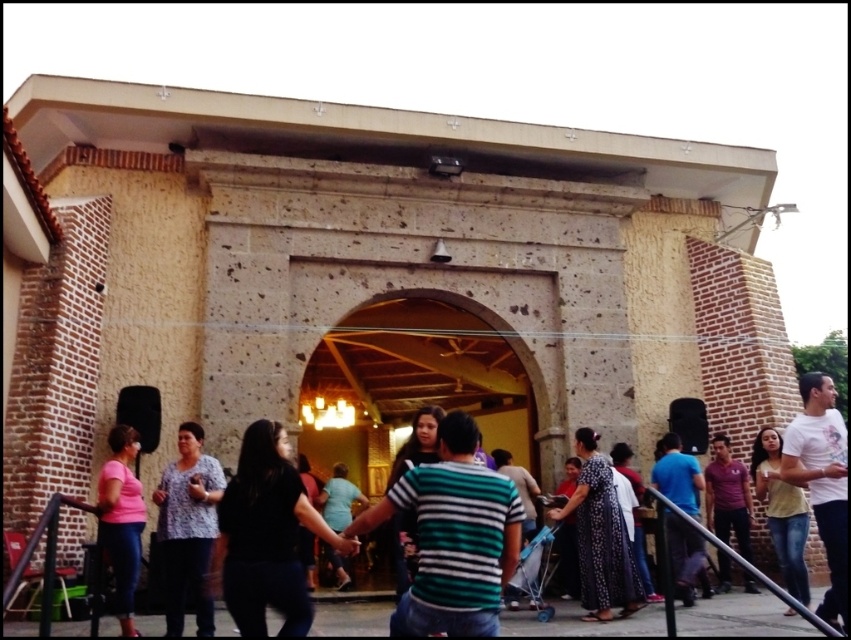
Question: Does light yellow shirt at center have a greater width compared to dark purple shirt at center?

Choices:
 (A) yes
 (B) no

Answer: (A)

Question: Is striped cotton shirt at center to the left of dark purple shirt at center from the viewer's perspective?

Choices:
 (A) no
 (B) yes

Answer: (B)

Question: Can you confirm if white cotton t-shirt at right is bigger than dark purple shirt at center?

Choices:
 (A) yes
 (B) no

Answer: (A)

Question: Which object is positioned closest to the black striped shirt at center?

Choices:
 (A) dark purple shirt at center
 (B) matte pink shirt at lower left
 (C) floral-patterned shirt at lower left
 (D) printed fabric dress at center

Answer: (D)

Question: Which of the following is the closest to the observer?

Choices:
 (A) black striped shirt at center
 (B) light yellow shirt at center
 (C) striped cotton shirt at center
 (D) blue cotton shirt at right

Answer: (A)

Question: Which of the following is the farthest from the observer?

Choices:
 (A) (686, 493)
 (B) (825, 515)

Answer: (A)